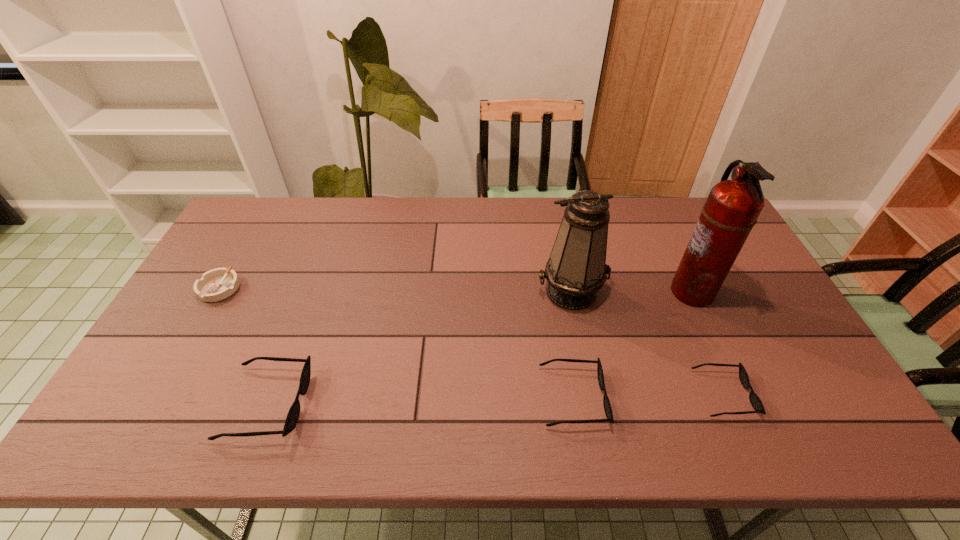
Image resolution: width=960 pixels, height=540 pixels. What are the coordinates of `spot to insert another sunglasses for uniform distribution` in the screenshot? It's located at (420, 400).